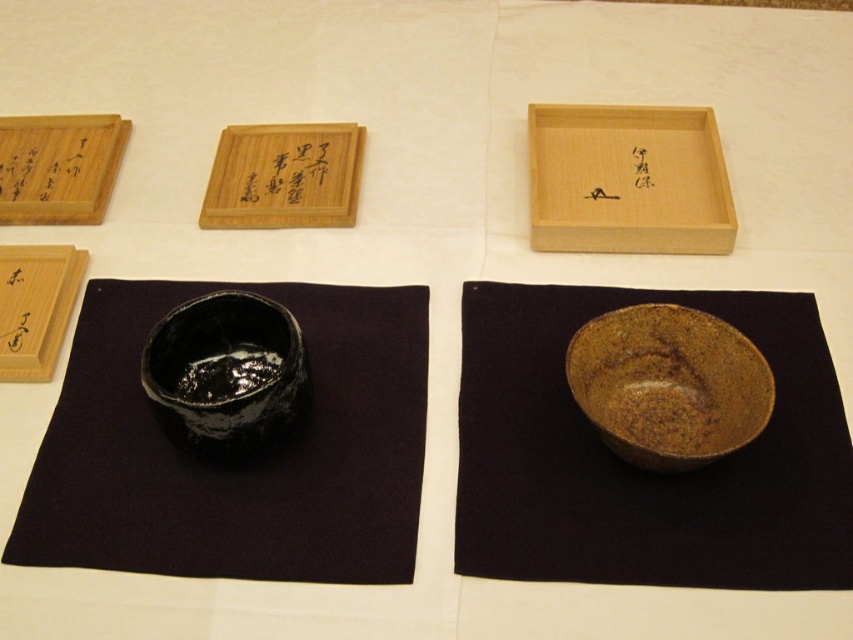
Question: In this image, where is brown textured bowl at lower right located relative to wooden tray at upper center?

Choices:
 (A) below
 (B) above

Answer: (A)

Question: Which of the following is the closest to the observer?

Choices:
 (A) wooden tray at upper center
 (B) black wood writing at upper left

Answer: (A)

Question: Which point is closer to the camera?

Choices:
 (A) (257, 182)
 (B) (286, 417)
 (C) (579, 150)

Answer: (B)

Question: In this image, where is brown textured bowl at lower right located relative to matte wood box at upper left?

Choices:
 (A) right
 (B) left

Answer: (A)

Question: Estimate the real-world distances between objects in this image. Which object is closer to the black matte bowl at lower left?

Choices:
 (A) matte wood box at left
 (B) natural wood tray at upper center
 (C) black glossy calligraphy at upper center

Answer: (A)

Question: Does black matte bowl at lower left appear on the right side of brown textured bowl at lower right?

Choices:
 (A) no
 (B) yes

Answer: (A)